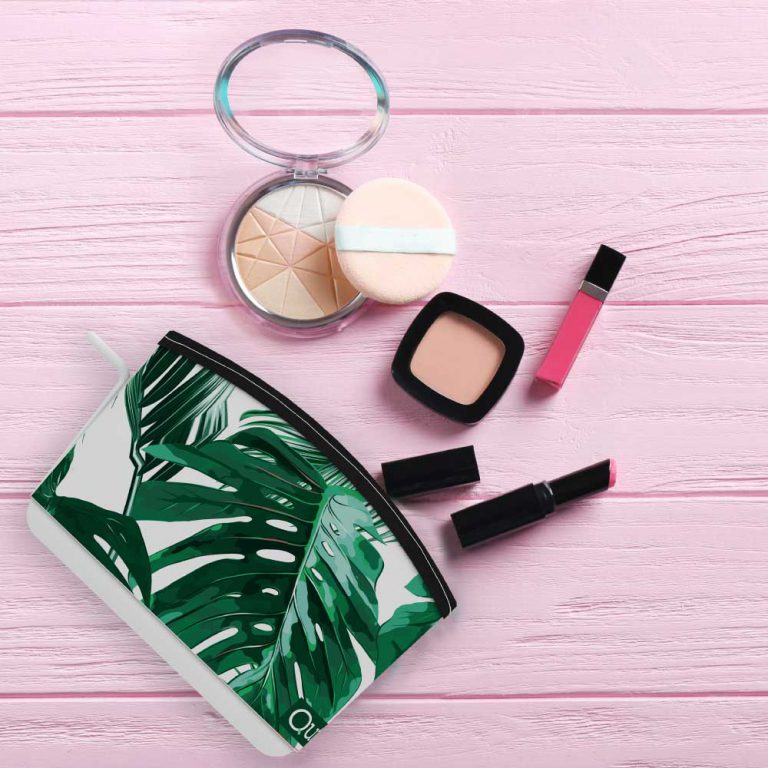
Identify the location of powder puff. (419, 223).